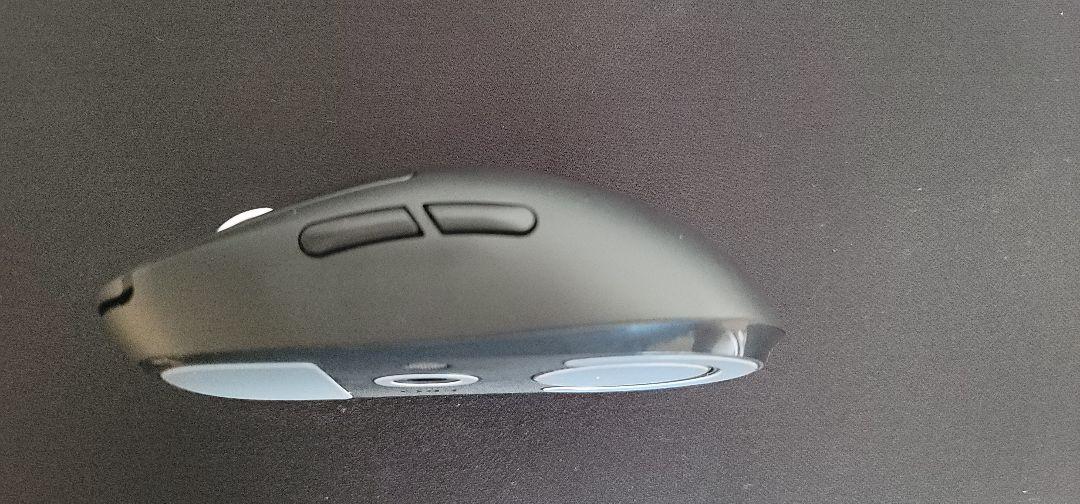
Locate an element on the screen. The height and width of the screenshot is (504, 1080). bottom of mouse is located at coordinates (498, 389).